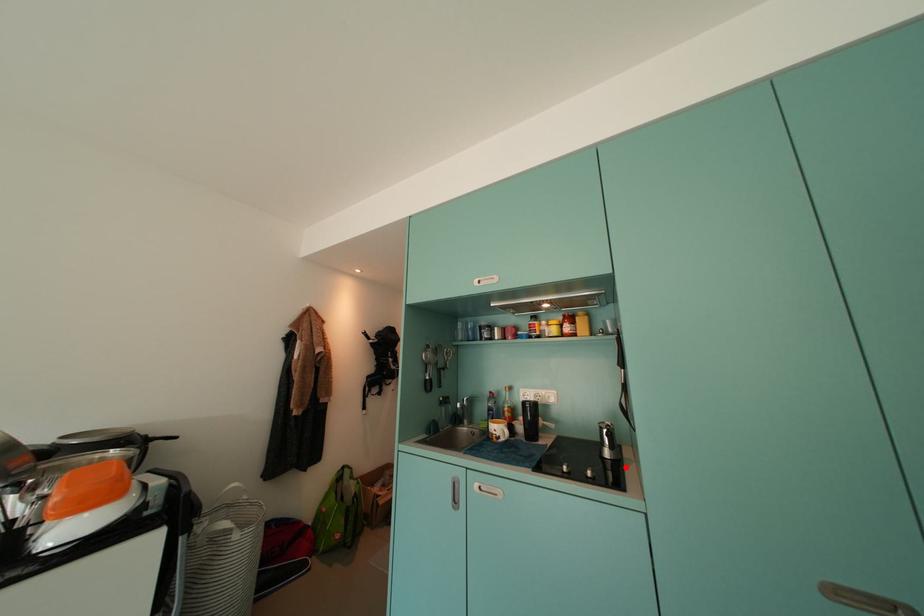
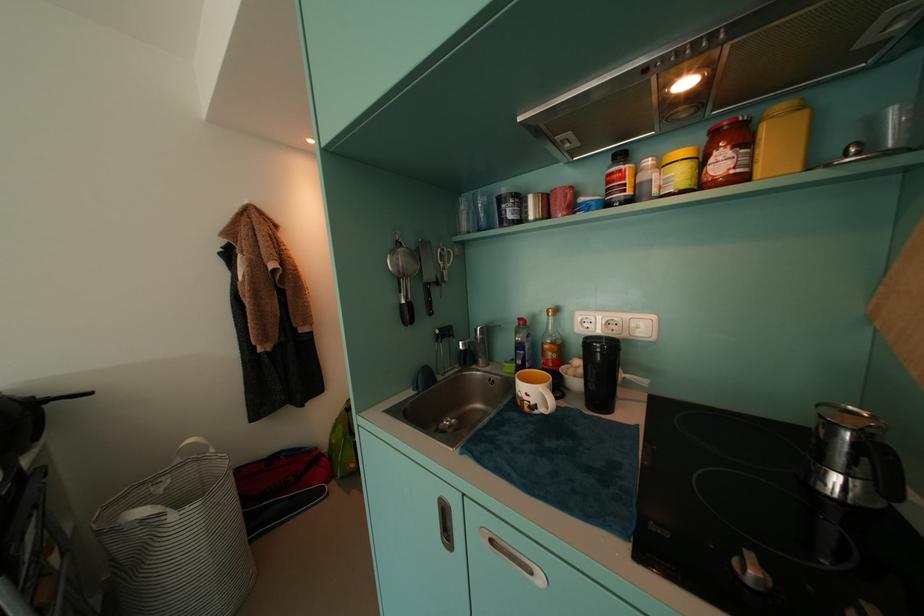
The point at the highlighted location is marked in the first image. Where is the corresponding point in the second image?

(891, 525)